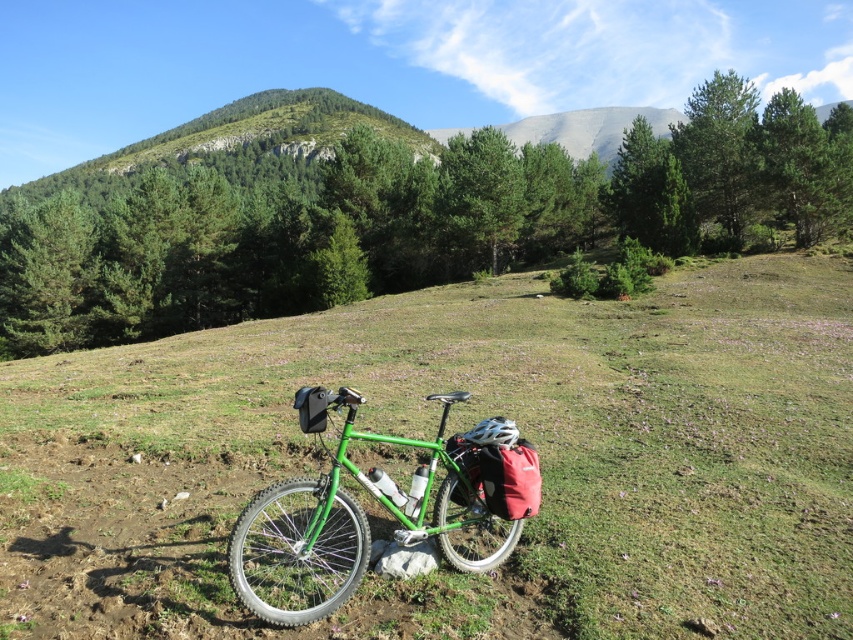
Question: Can you confirm if green matte grass at center is positioned below green matte bicycle at center?

Choices:
 (A) no
 (B) yes

Answer: (A)

Question: Among these points, which one is nearest to the camera?

Choices:
 (A) (718, 604)
 (B) (312, 529)

Answer: (B)

Question: Is the position of green matte grass at center less distant than that of green matte bicycle at center?

Choices:
 (A) yes
 (B) no

Answer: (B)

Question: From the image, what is the correct spatial relationship of green matte grass at center in relation to green matte bicycle at center?

Choices:
 (A) right
 (B) left

Answer: (A)